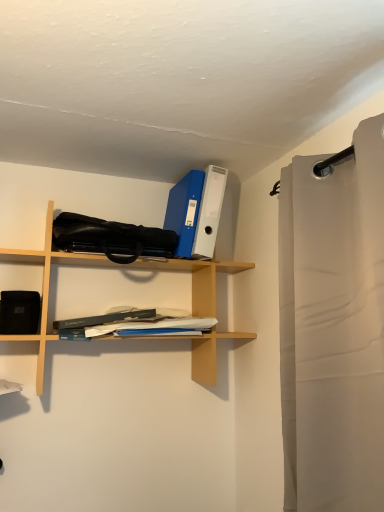
This screenshot has width=384, height=512. What do you see at coordinates (333, 326) in the screenshot?
I see `light beige fabric shower curtain at right` at bounding box center [333, 326].

Describe the element at coordinates (47, 285) in the screenshot. This screenshot has width=384, height=512. I see `wooden shelf at upper center` at that location.

The image size is (384, 512). I want to click on black matte speaker at left, so click(x=20, y=305).

Are black matte speaker at left and light beige fabric shower curtain at right located far from each other?

No, black matte speaker at left is in close proximity to light beige fabric shower curtain at right.

Based on their positions, is black matte speaker at left located to the left or right of light beige fabric shower curtain at right?

Based on their positions, black matte speaker at left is located to the left of light beige fabric shower curtain at right.

Considering the sizes of objects black matte speaker at left and light beige fabric shower curtain at right in the image provided, who is bigger, black matte speaker at left or light beige fabric shower curtain at right?

With larger size is light beige fabric shower curtain at right.

Which object is thinner, black matte speaker at left or light beige fabric shower curtain at right?

black matte speaker at left.

Considering the positions of point (80, 320) and point (7, 298), is point (80, 320) closer or farther from the camera than point (7, 298)?

Point (80, 320).

Which object is positioned more to the right, white paper at center or black matte speaker at left?

white paper at center.

In the scene shown: Is white paper at center facing towards black matte speaker at left?

No, white paper at center is not facing towards black matte speaker at left.

Is white paper at center in contact with black matte speaker at left?

No, white paper at center is not touching black matte speaker at left.

Does black matte speaker at left have a lesser width compared to white paper at center?

Yes, black matte speaker at left is thinner than white paper at center.

Considering the relative positions of black matte speaker at left and white paper at center in the image provided, is black matte speaker at left to the left or to the right of white paper at center?

From the image, it's evident that black matte speaker at left is to the left of white paper at center.

Can we say black matte speaker at left lies outside white paper at center?

Yes, black matte speaker at left is located beyond the bounds of white paper at center.

Based on their sizes in the image, would you say wooden shelf at upper center is bigger or smaller than white paper at center?

wooden shelf at upper center is bigger than white paper at center.

In terms of height, does wooden shelf at upper center look taller or shorter compared to white paper at center?

In the image, wooden shelf at upper center appears to be taller than white paper at center.

I want to click on book lying on the right of wooden shelf at upper center, so click(x=138, y=321).

In the image, is wooden shelf at upper center positioned in front of or behind white paper at center?

wooden shelf at upper center is positioned closer to the viewer than white paper at center.

From a real-world perspective, between light beige fabric shower curtain at right and black matte speaker at left, who is vertically lower?

In real-world perspective, light beige fabric shower curtain at right is lower.

Is light beige fabric shower curtain at right not inside black matte speaker at left?

Yes, light beige fabric shower curtain at right is not within black matte speaker at left.

Which of these two, light beige fabric shower curtain at right or black matte speaker at left, is bigger?

light beige fabric shower curtain at right is bigger.

Does light beige fabric shower curtain at right have a lesser width compared to black matte speaker at left?

No, light beige fabric shower curtain at right is not thinner than black matte speaker at left.

How many degrees apart are the facing directions of wooden shelf at upper center and black matte speaker at left?

The angular difference between wooden shelf at upper center and black matte speaker at left is 1.51 degrees.

Is wooden shelf at upper center to the left of black matte speaker at left from the viewer's perspective?

In fact, wooden shelf at upper center is to the right of black matte speaker at left.

Considering the positions of points (51, 223) and (27, 286), is point (51, 223) farther from camera compared to point (27, 286)?

No, (51, 223) is in front of (27, 286).

Is there a large distance between wooden shelf at upper center and black matte speaker at left?

That's not correct — wooden shelf at upper center is a little close to black matte speaker at left.

In the image, is light beige fabric shower curtain at right on the left side or the right side of wooden shelf at upper center?

light beige fabric shower curtain at right is to the right of wooden shelf at upper center.

How much distance is there between light beige fabric shower curtain at right and wooden shelf at upper center?

They are 23.30 inches apart.

From the image's perspective, between light beige fabric shower curtain at right and wooden shelf at upper center, which one is located above?

wooden shelf at upper center appears higher in the image.

Which of these two, light beige fabric shower curtain at right or wooden shelf at upper center, stands shorter?

Standing shorter between the two is wooden shelf at upper center.

Where is `cabinet that appears above the light beige fabric shower curtain at right (from a real-world perspective)`? The height and width of the screenshot is (512, 384). cabinet that appears above the light beige fabric shower curtain at right (from a real-world perspective) is located at coordinates (20, 305).

Where is `cabinet on the left of the white paper at center`? cabinet on the left of the white paper at center is located at coordinates (20, 305).

Which object lies nearer to the anchor point black matte speaker at left, light beige fabric shower curtain at right or wooden shelf at upper center?

Based on the image, wooden shelf at upper center appears to be nearer to black matte speaker at left.

When comparing their distances from wooden shelf at upper center, does light beige fabric shower curtain at right or white paper at center seem further?

light beige fabric shower curtain at right.

Which object lies nearer to the anchor point wooden shelf at upper center, black matte speaker at left or light beige fabric shower curtain at right?

black matte speaker at left is positioned closer to the anchor wooden shelf at upper center.

From the image, which object appears to be farther from light beige fabric shower curtain at right, white paper at center or wooden shelf at upper center?

wooden shelf at upper center is further to light beige fabric shower curtain at right.

From the image, which object appears to be farther from black matte speaker at left, light beige fabric shower curtain at right or white paper at center?

light beige fabric shower curtain at right.

Looking at this image, based on their spatial positions, is black matte speaker at left or white paper at center further from wooden shelf at upper center?

black matte speaker at left.

Estimate the real-world distances between objects in this image. Which object is closer to black matte speaker at left, white paper at center or light beige fabric shower curtain at right?

white paper at center is closer to black matte speaker at left.

Considering their positions, is black matte speaker at left positioned closer to light beige fabric shower curtain at right than white paper at center?

white paper at center lies closer to light beige fabric shower curtain at right than the other object.

This screenshot has height=512, width=384. Identify the location of shelf between black matte speaker at left and white paper at center from left to right. (47, 285).

Locate an element on the screen. The height and width of the screenshot is (512, 384). shelf between black matte speaker at left and light beige fabric shower curtain at right in the horizontal direction is located at coordinates (47, 285).

Locate an element on the screen. book between black matte speaker at left and light beige fabric shower curtain at right from left to right is located at coordinates (138, 321).

This screenshot has width=384, height=512. I want to click on shelf between light beige fabric shower curtain at right and white paper at center from front to back, so click(47, 285).